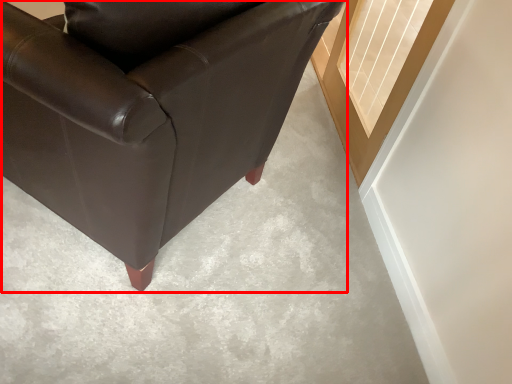
Question: From the image's perspective, what is the correct spatial positioning of chair (annotated by the red box) in reference to window?

Choices:
 (A) above
 (B) below

Answer: (B)